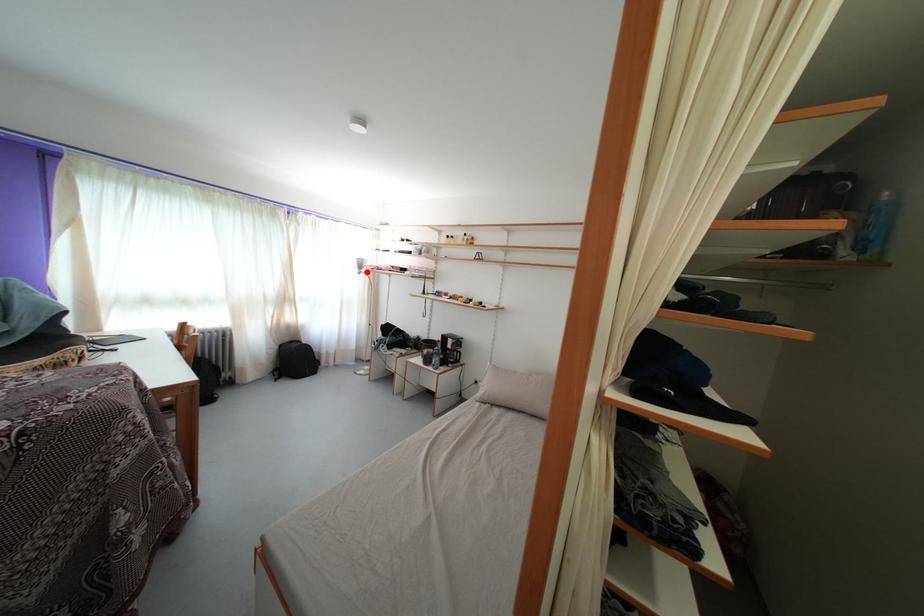
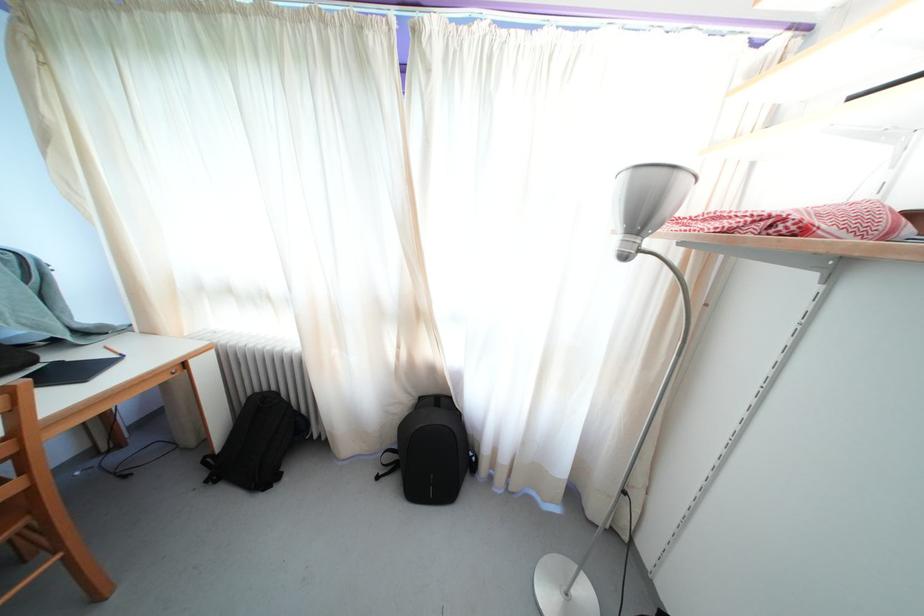
The point at the highlighted location is marked in the first image. Where is the corresponding point in the second image?

(648, 223)